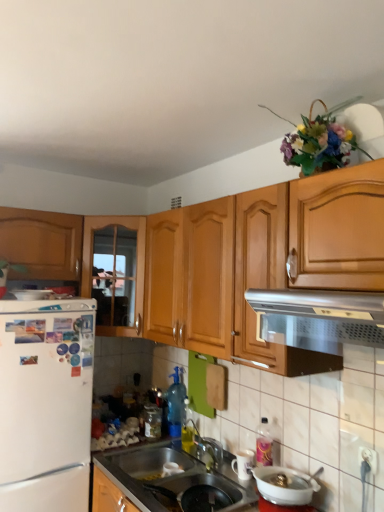
You are a GUI agent. You are given a task and a screenshot of the screen. Output one action in this format:
    pyautogui.click(x=<x>, y=<y>)
    Task: Click on the free spot above white glossy bowl at lower center, which is the 1th appliance in front-to-back order (from a real-world perspective)
    
    Given the screenshot: What is the action you would take?
    pyautogui.click(x=290, y=488)